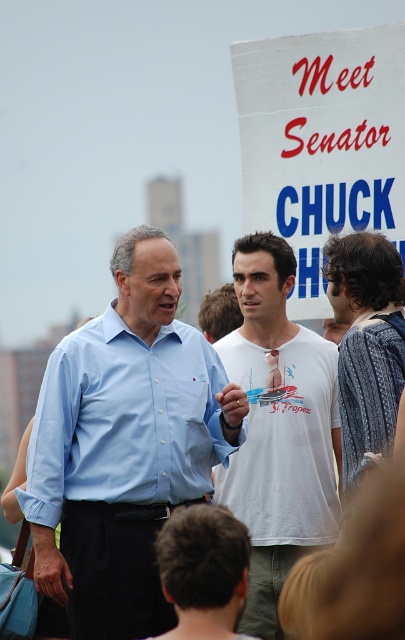
Does white paper sign at upper center appear over matte blue shirt at center?

Indeed, white paper sign at upper center is positioned over matte blue shirt at center.

Is white paper sign at upper center shorter than matte blue shirt at center?

In fact, white paper sign at upper center may be taller than matte blue shirt at center.

Which is in front, point (341, 184) or point (76, 385)?

Point (76, 385) is more forward.

Identify the location of white paper sign at upper center. (321, 144).

Is white paper sign at upper center smaller than white cotton t-shirt at center?

No.

Which is in front, point (375, 44) or point (300, 548)?

Positioned in front is point (300, 548).

Between point (330, 102) and point (266, 625), which one is positioned behind?

Positioned behind is point (330, 102).

Locate an element on the screen. The width and height of the screenshot is (405, 640). white paper sign at upper center is located at coordinates (321, 144).

Which of these two, white cotton t-shirt at center or patterned fabric shirt at right, stands taller?

white cotton t-shirt at center

Is white cotton t-shirt at center shorter than patterned fabric shirt at right?

No, white cotton t-shirt at center is not shorter than patterned fabric shirt at right.

Which is in front, point (251, 280) or point (379, 285)?

Point (379, 285) is more forward.

Locate an element on the screen. This screenshot has height=640, width=405. white cotton t-shirt at center is located at coordinates (279, 428).